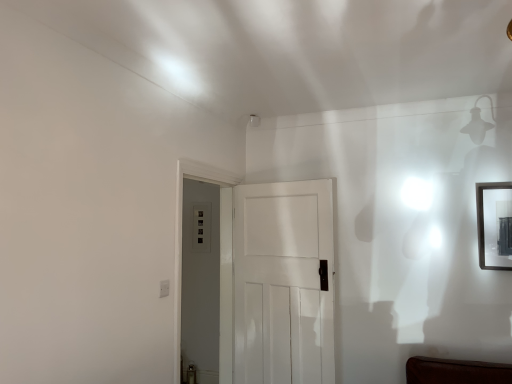
What do you see at coordinates (280, 285) in the screenshot? I see `white glossy door at center` at bounding box center [280, 285].

Identify the location of white glossy door at center. (280, 285).

The image size is (512, 384). Find the location of `white glossy door at center`. white glossy door at center is located at coordinates (280, 285).